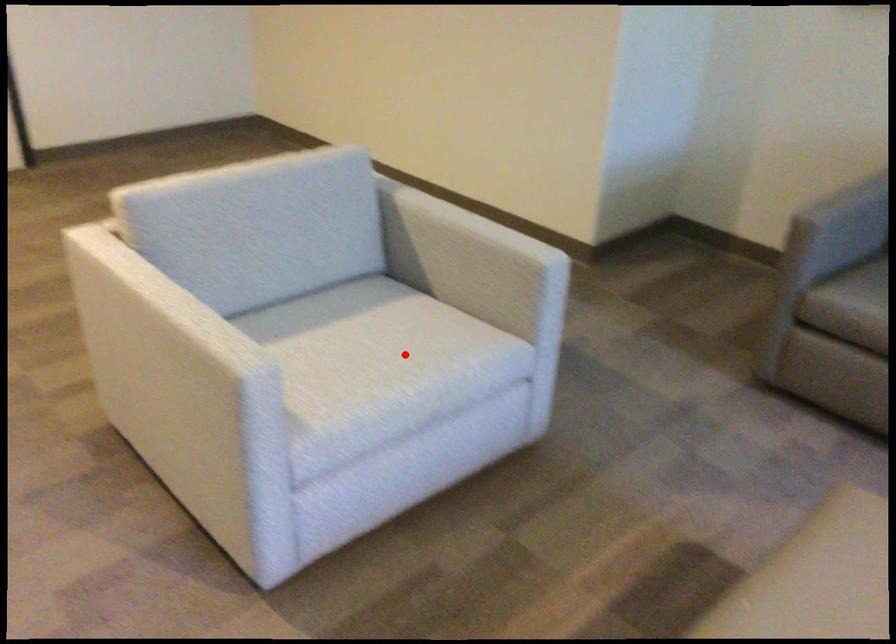
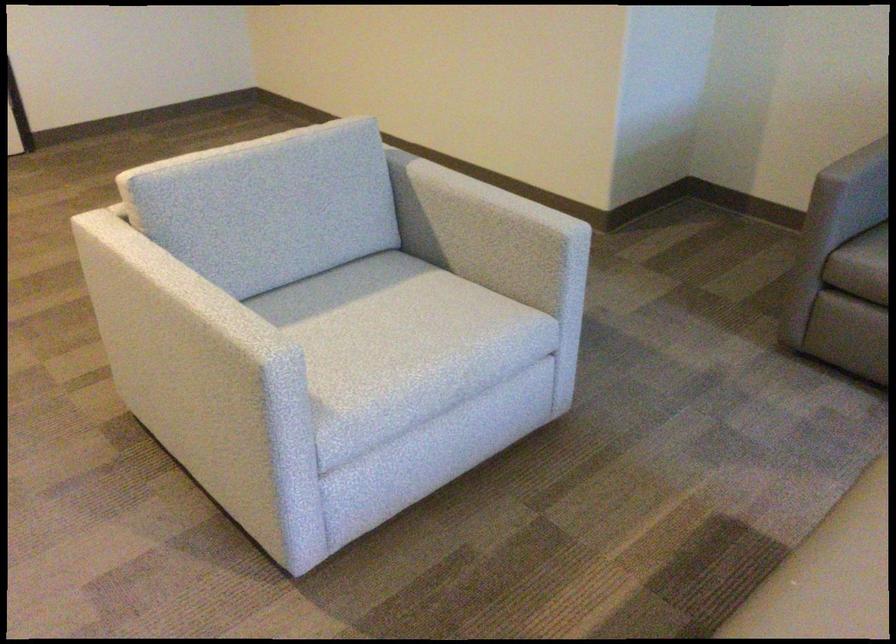
Locate, in the second image, the point that corresponds to the highlighted location in the first image.

(427, 333)